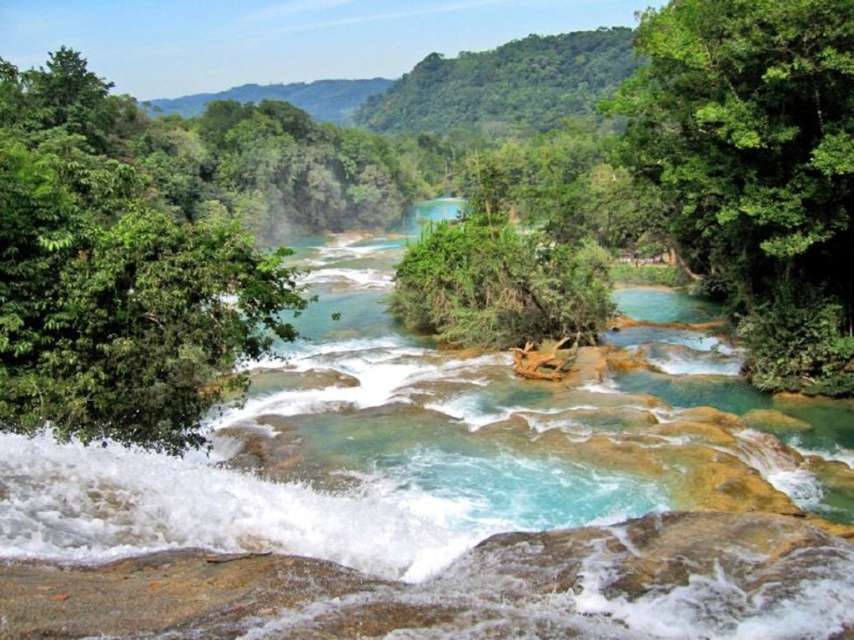
Question: Which point is farther from the camera taking this photo?

Choices:
 (A) (746, 193)
 (B) (158, 301)

Answer: (A)

Question: Is green leafy tree at left smaller than green leafy tree at upper right?

Choices:
 (A) no
 (B) yes

Answer: (A)

Question: Is green leafy tree at left wider than green leafy tree at upper right?

Choices:
 (A) no
 (B) yes

Answer: (B)

Question: Is green leafy tree at left below green leafy tree at upper right?

Choices:
 (A) yes
 (B) no

Answer: (B)